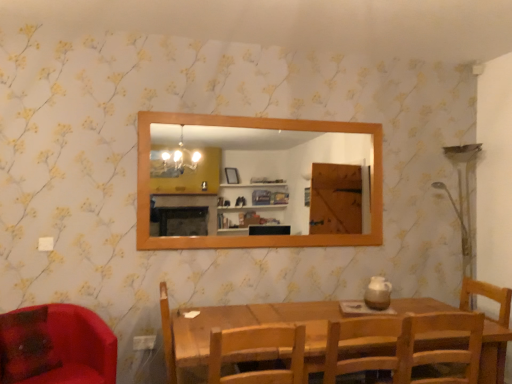
Question: From a real-world perspective, is wooden chair at center, arranged as the 2th chair when viewed from the right, beneath wooden mirror at upper center?

Choices:
 (A) yes
 (B) no

Answer: (A)

Question: Is wooden mirror at upper center inside wooden chair at center, arranged as the third chair when viewed from the left?

Choices:
 (A) no
 (B) yes

Answer: (A)

Question: Is wooden mirror at upper center at the back of wooden chair at center, arranged as the 2th chair when viewed from the right?

Choices:
 (A) no
 (B) yes

Answer: (A)

Question: Is wooden chair at center, arranged as the third chair when viewed from the left, touching wooden mirror at upper center?

Choices:
 (A) yes
 (B) no

Answer: (B)

Question: Is wooden chair at center, arranged as the third chair when viewed from the left, positioned before wooden mirror at upper center?

Choices:
 (A) yes
 (B) no

Answer: (A)

Question: Does point (352, 180) appear closer or farther from the camera than point (374, 317)?

Choices:
 (A) farther
 (B) closer

Answer: (A)

Question: Based on their sizes in the image, would you say wooden mirror at upper center is bigger or smaller than wooden chair at center, arranged as the 2th chair when viewed from the right?

Choices:
 (A) small
 (B) big

Answer: (A)

Question: Is wooden mirror at upper center wider or thinner than wooden chair at center, arranged as the third chair when viewed from the left?

Choices:
 (A) thin
 (B) wide

Answer: (A)

Question: From a real-world perspective, relative to wooden chair at center, arranged as the third chair when viewed from the left, is wooden mirror at upper center vertically above or below?

Choices:
 (A) below
 (B) above

Answer: (B)

Question: From the image's perspective, is wooden chair at center, positioned as the second chair in left-to-right order, located above or below wooden chair at lower right, which is counted as the 1th chair, starting from the right?

Choices:
 (A) below
 (B) above

Answer: (B)

Question: Choose the correct answer: Is wooden chair at center, arranged as the third chair when viewed from the right, inside wooden chair at lower right, which is counted as the 1th chair, starting from the right, or outside it?

Choices:
 (A) inside
 (B) outside

Answer: (B)

Question: Based on their sizes in the image, would you say wooden chair at center, arranged as the third chair when viewed from the right, is bigger or smaller than wooden chair at lower right, which is counted as the fourth chair, starting from the left?

Choices:
 (A) small
 (B) big

Answer: (A)

Question: Looking at their shapes, would you say wooden chair at center, positioned as the second chair in left-to-right order, is wider or thinner than wooden chair at lower right, which is counted as the 1th chair, starting from the right?

Choices:
 (A) thin
 (B) wide

Answer: (B)

Question: From a real-world perspective, is wooden chair at lower right, which is counted as the 1th chair, starting from the right, physically located above or below wooden chair at center, arranged as the third chair when viewed from the left?

Choices:
 (A) above
 (B) below

Answer: (B)

Question: Relative to wooden chair at center, arranged as the 2th chair when viewed from the right, is wooden chair at lower right, which is counted as the 1th chair, starting from the right, in front or behind?

Choices:
 (A) front
 (B) behind

Answer: (B)